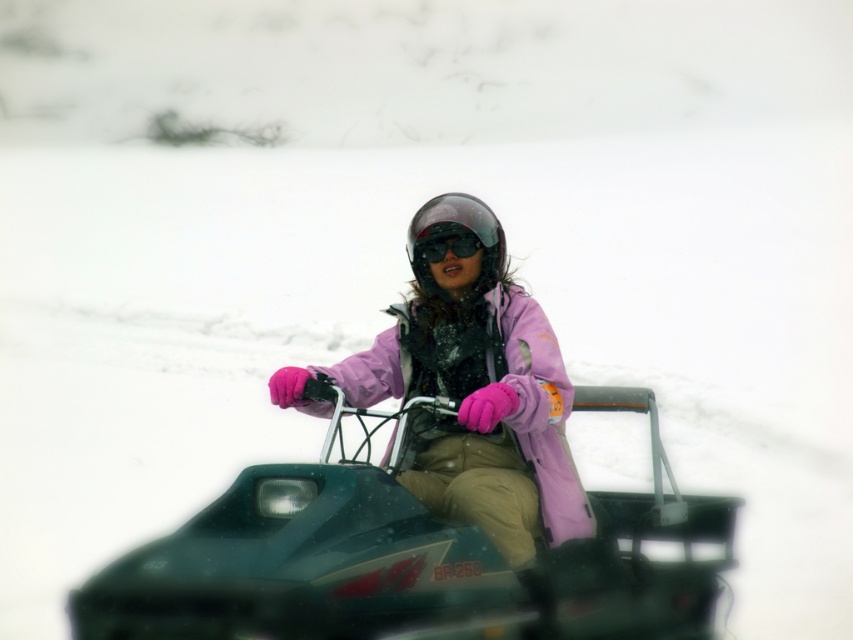
Question: Based on their relative distances, which object is nearer to the metallic teal snowmobile at center?

Choices:
 (A) pink matte jacket at center
 (B) transparent plastic helmet at center
 (C) black matte goggles at center

Answer: (A)

Question: Which is nearer to the pink matte jacket at center?

Choices:
 (A) transparent plastic helmet at center
 (B) black matte goggles at center

Answer: (B)

Question: Estimate the real-world distances between objects in this image. Which object is farther from the pink matte jacket at center?

Choices:
 (A) black matte goggles at center
 (B) metallic teal snowmobile at center

Answer: (A)

Question: From the image, what is the correct spatial relationship of metallic teal snowmobile at center in relation to pink matte jacket at center?

Choices:
 (A) above
 (B) below

Answer: (B)

Question: Is metallic teal snowmobile at center positioned in front of black matte goggles at center?

Choices:
 (A) yes
 (B) no

Answer: (A)

Question: Is pink matte jacket at center thinner than black matte goggles at center?

Choices:
 (A) yes
 (B) no

Answer: (B)